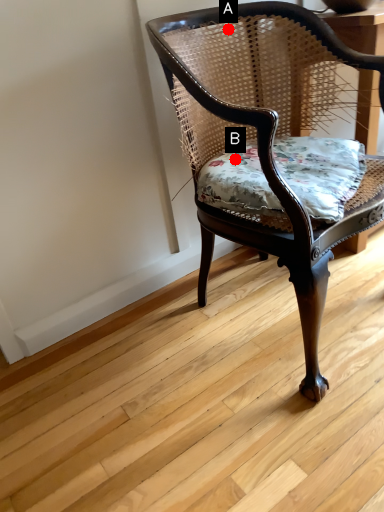
Question: Two points are circled on the image, labeled by A and B beside each circle. Which of the following is the farthest from the observer?

Choices:
 (A) A is further
 (B) B is further

Answer: (A)